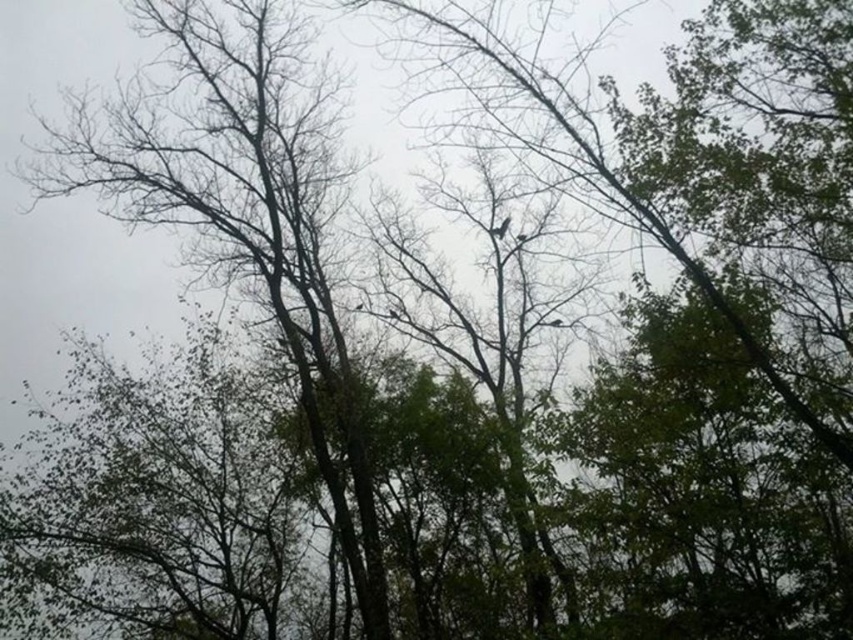
Question: Which point is closer to the camera?

Choices:
 (A) (160, 92)
 (B) (509, 220)

Answer: (A)

Question: Which object appears farthest from the camera in this image?

Choices:
 (A) bare branches at center
 (B) dark brown feathered bird at center

Answer: (B)

Question: Does bare branches at center appear over dark brown feathered bird at center?

Choices:
 (A) yes
 (B) no

Answer: (B)

Question: Does bare branches at center appear on the left side of dark brown feathered bird at center?

Choices:
 (A) no
 (B) yes

Answer: (B)

Question: Does bare branches at center come in front of dark brown feathered bird at center?

Choices:
 (A) yes
 (B) no

Answer: (A)